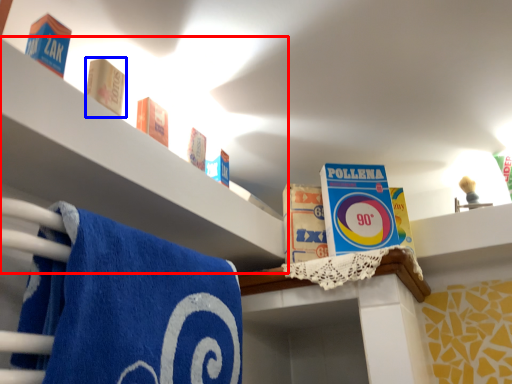
Question: Which object appears closest to the camera in this image, shelf (highlighted by a red box) or product (highlighted by a blue box)?

Choices:
 (A) shelf
 (B) product

Answer: (A)